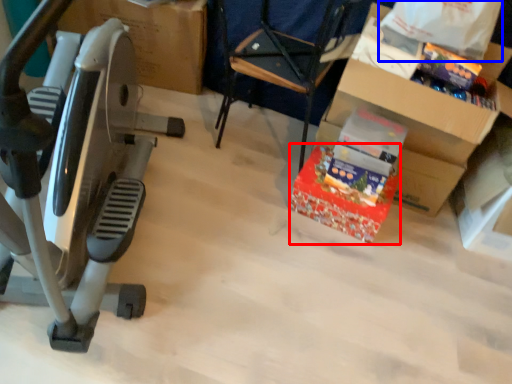
Question: Which object is further to the camera taking this photo, gift (highlighted by a red box) or grocery bag (highlighted by a blue box)?

Choices:
 (A) gift
 (B) grocery bag

Answer: (A)